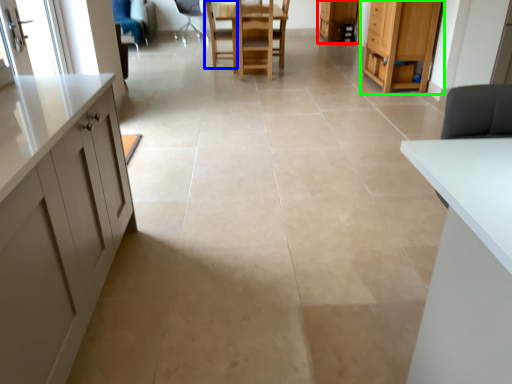
Question: Based on their relative distances, which object is farther from cabinetry (highlighted by a red box)? Choose from chair (highlighted by a blue box) and cabinetry (highlighted by a green box).

Choices:
 (A) chair
 (B) cabinetry

Answer: (B)